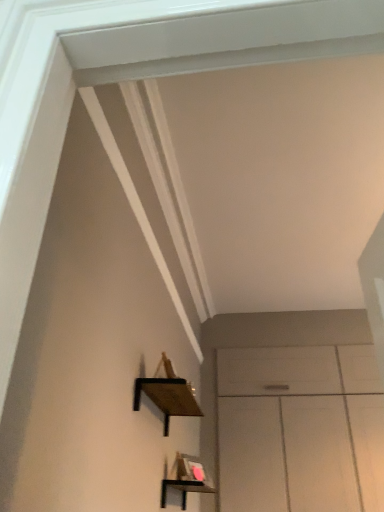
This screenshot has height=512, width=384. In order to click on wooden at left, which is the 2th shelf from bottom to top in this screenshot , I will do `click(167, 394)`.

Describe the element at coordinates (167, 394) in the screenshot. The height and width of the screenshot is (512, 384). I see `wooden at left, which is the 2th shelf from bottom to top` at that location.

The height and width of the screenshot is (512, 384). What do you see at coordinates (184, 489) in the screenshot?
I see `black wood shelf at lower center, positioned as the 2th shelf in top-to-bottom order` at bounding box center [184, 489].

The width and height of the screenshot is (384, 512). I want to click on black wood shelf at lower center, placed as the first shelf when sorted from bottom to top, so click(184, 489).

I want to click on wooden at left, which is the 2th shelf from bottom to top, so click(x=167, y=394).

Would you say black wood shelf at lower center, placed as the first shelf when sorted from bottom to top, is to the left or to the right of wooden at left, which is the 2th shelf from bottom to top, in the picture?

Based on their positions, black wood shelf at lower center, placed as the first shelf when sorted from bottom to top, is located to the right of wooden at left, which is the 2th shelf from bottom to top.

Between black wood shelf at lower center, positioned as the 2th shelf in top-to-bottom order, and wooden at left, which ranks as the first shelf in top-to-bottom order, which one is positioned in front?

wooden at left, which ranks as the first shelf in top-to-bottom order.

Is point (203, 490) farther from viewer compared to point (164, 394)?

Yes, point (203, 490) is farther from viewer.

From the image's perspective, would you say black wood shelf at lower center, placed as the first shelf when sorted from bottom to top, is shown under wooden at left, which is the 2th shelf from bottom to top?

Yes, from the image's perspective, black wood shelf at lower center, placed as the first shelf when sorted from bottom to top, is beneath wooden at left, which is the 2th shelf from bottom to top.

From a real-world perspective, who is located lower, black wood shelf at lower center, positioned as the 2th shelf in top-to-bottom order, or wooden at left, which is the 2th shelf from bottom to top?

black wood shelf at lower center, positioned as the 2th shelf in top-to-bottom order, from a real-world perspective.

Considering the relative sizes of black wood shelf at lower center, positioned as the 2th shelf in top-to-bottom order, and wooden at left, which is the 2th shelf from bottom to top, in the image provided, is black wood shelf at lower center, positioned as the 2th shelf in top-to-bottom order, wider than wooden at left, which is the 2th shelf from bottom to top,?

Yes, black wood shelf at lower center, positioned as the 2th shelf in top-to-bottom order, is wider than wooden at left, which is the 2th shelf from bottom to top.

Can you confirm if black wood shelf at lower center, placed as the first shelf when sorted from bottom to top, is shorter than wooden at left, which ranks as the first shelf in top-to-bottom order?

No, black wood shelf at lower center, placed as the first shelf when sorted from bottom to top, is not shorter than wooden at left, which ranks as the first shelf in top-to-bottom order.

Looking at the image, does black wood shelf at lower center, positioned as the 2th shelf in top-to-bottom order, seem bigger or smaller compared to wooden at left, which ranks as the first shelf in top-to-bottom order?

Clearly, black wood shelf at lower center, positioned as the 2th shelf in top-to-bottom order, is larger in size than wooden at left, which ranks as the first shelf in top-to-bottom order.

Is black wood shelf at lower center, positioned as the 2th shelf in top-to-bottom order, spatially inside wooden at left, which ranks as the first shelf in top-to-bottom order, or outside of it?

black wood shelf at lower center, positioned as the 2th shelf in top-to-bottom order, cannot be found inside wooden at left, which ranks as the first shelf in top-to-bottom order.

Is black wood shelf at lower center, positioned as the 2th shelf in top-to-bottom order, positioned far away from wooden at left, which is the 2th shelf from bottom to top?

No, black wood shelf at lower center, positioned as the 2th shelf in top-to-bottom order, is in close proximity to wooden at left, which is the 2th shelf from bottom to top.

Is black wood shelf at lower center, placed as the first shelf when sorted from bottom to top, looking in the opposite direction of wooden at left, which is the 2th shelf from bottom to top?

No, black wood shelf at lower center, placed as the first shelf when sorted from bottom to top, is not facing the opposite direction of wooden at left, which is the 2th shelf from bottom to top.

From the picture: How many degrees apart are the facing directions of black wood shelf at lower center, positioned as the 2th shelf in top-to-bottom order, and wooden at left, which ranks as the first shelf in top-to-bottom order?

black wood shelf at lower center, positioned as the 2th shelf in top-to-bottom order, and wooden at left, which ranks as the first shelf in top-to-bottom order, are facing 0.547 degrees away from each other.

Measure the distance from black wood shelf at lower center, positioned as the 2th shelf in top-to-bottom order, to wooden at left, which is the 2th shelf from bottom to top.

black wood shelf at lower center, positioned as the 2th shelf in top-to-bottom order, and wooden at left, which is the 2th shelf from bottom to top, are 52.70 centimeters apart from each other.

You are a GUI agent. You are given a task and a screenshot of the screen. Output one action in this format:
    pyautogui.click(x=<x>, y=<y>)
    Task: Click on the shelf on the right of wooden at left, which is the 2th shelf from bottom to top
    The width and height of the screenshot is (384, 512).
    Given the screenshot: What is the action you would take?
    pyautogui.click(x=184, y=489)

In the scene shown: Does wooden at left, which is the 2th shelf from bottom to top, appear on the right side of black wood shelf at lower center, placed as the first shelf when sorted from bottom to top?

In fact, wooden at left, which is the 2th shelf from bottom to top, is to the left of black wood shelf at lower center, placed as the first shelf when sorted from bottom to top.

Does wooden at left, which is the 2th shelf from bottom to top, come in front of black wood shelf at lower center, placed as the first shelf when sorted from bottom to top?

That is True.

Does point (184, 402) appear closer or farther from the camera than point (182, 502)?

Point (184, 402) is positioned closer to the camera compared to point (182, 502).

From the image's perspective, between wooden at left, which ranks as the first shelf in top-to-bottom order, and black wood shelf at lower center, placed as the first shelf when sorted from bottom to top, who is located below?

From the image's view, black wood shelf at lower center, placed as the first shelf when sorted from bottom to top, is below.

Consider the image. From a real-world perspective, who is located higher, wooden at left, which ranks as the first shelf in top-to-bottom order, or black wood shelf at lower center, positioned as the 2th shelf in top-to-bottom order?

wooden at left, which ranks as the first shelf in top-to-bottom order.

Is wooden at left, which ranks as the first shelf in top-to-bottom order, wider than black wood shelf at lower center, positioned as the 2th shelf in top-to-bottom order?

Incorrect, the width of wooden at left, which ranks as the first shelf in top-to-bottom order, does not surpass that of black wood shelf at lower center, positioned as the 2th shelf in top-to-bottom order.

Considering the sizes of objects wooden at left, which ranks as the first shelf in top-to-bottom order, and black wood shelf at lower center, placed as the first shelf when sorted from bottom to top, in the image provided, who is taller, wooden at left, which ranks as the first shelf in top-to-bottom order, or black wood shelf at lower center, placed as the first shelf when sorted from bottom to top,?

With more height is black wood shelf at lower center, placed as the first shelf when sorted from bottom to top.

Between wooden at left, which ranks as the first shelf in top-to-bottom order, and black wood shelf at lower center, positioned as the 2th shelf in top-to-bottom order, which one has larger size?

black wood shelf at lower center, positioned as the 2th shelf in top-to-bottom order, is bigger.

Which is correct: wooden at left, which is the 2th shelf from bottom to top, is inside black wood shelf at lower center, positioned as the 2th shelf in top-to-bottom order, or outside of it?

wooden at left, which is the 2th shelf from bottom to top, is outside black wood shelf at lower center, positioned as the 2th shelf in top-to-bottom order.

Are wooden at left, which is the 2th shelf from bottom to top, and black wood shelf at lower center, placed as the first shelf when sorted from bottom to top, beside each other?

No, wooden at left, which is the 2th shelf from bottom to top, is not making contact with black wood shelf at lower center, placed as the first shelf when sorted from bottom to top.

Does wooden at left, which ranks as the first shelf in top-to-bottom order, turn towards black wood shelf at lower center, positioned as the 2th shelf in top-to-bottom order?

No, wooden at left, which ranks as the first shelf in top-to-bottom order, is not facing towards black wood shelf at lower center, positioned as the 2th shelf in top-to-bottom order.

Can you tell me how much wooden at left, which is the 2th shelf from bottom to top, and black wood shelf at lower center, placed as the first shelf when sorted from bottom to top, differ in facing direction?

The angle between the facing direction of wooden at left, which is the 2th shelf from bottom to top, and the facing direction of black wood shelf at lower center, placed as the first shelf when sorted from bottom to top, is 0.547 degrees.

Image resolution: width=384 pixels, height=512 pixels. Find the location of `shelf above the black wood shelf at lower center, positioned as the 2th shelf in top-to-bottom order (from a real-world perspective)`. shelf above the black wood shelf at lower center, positioned as the 2th shelf in top-to-bottom order (from a real-world perspective) is located at coordinates (167, 394).

This screenshot has width=384, height=512. Find the location of `shelf behind the wooden at left, which is the 2th shelf from bottom to top`. shelf behind the wooden at left, which is the 2th shelf from bottom to top is located at coordinates (184, 489).

The width and height of the screenshot is (384, 512). Identify the location of shelf on the left of black wood shelf at lower center, placed as the first shelf when sorted from bottom to top. (167, 394).